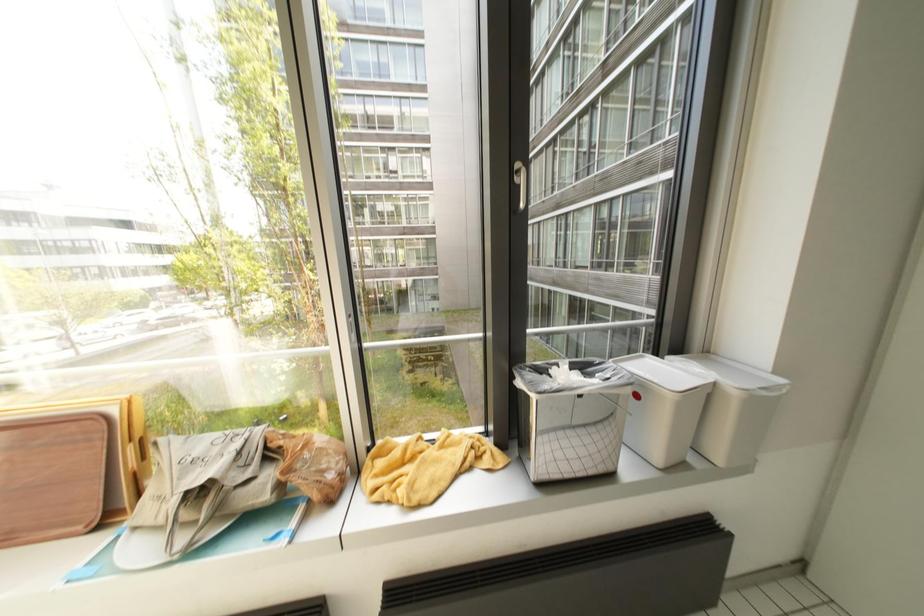
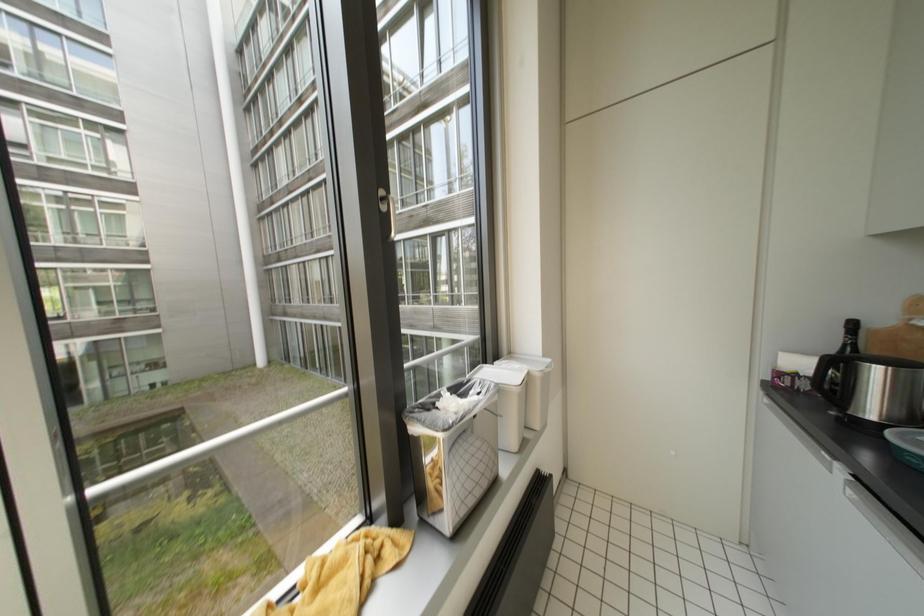
Question: Based on the continuous images, in which direction is the camera rotating? Reply with the corresponding letter.

Choices:
 (A) Left
 (B) Right
 (C) Up
 (D) Down

Answer: (B)